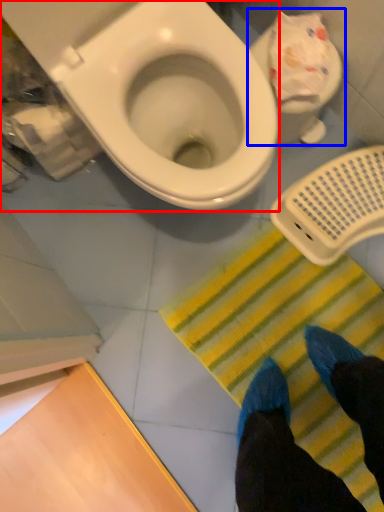
Question: Which of the following is the farthest to the observer, toilet (highlighted by a red box) or toilet (highlighted by a blue box)?

Choices:
 (A) toilet
 (B) toilet

Answer: (B)